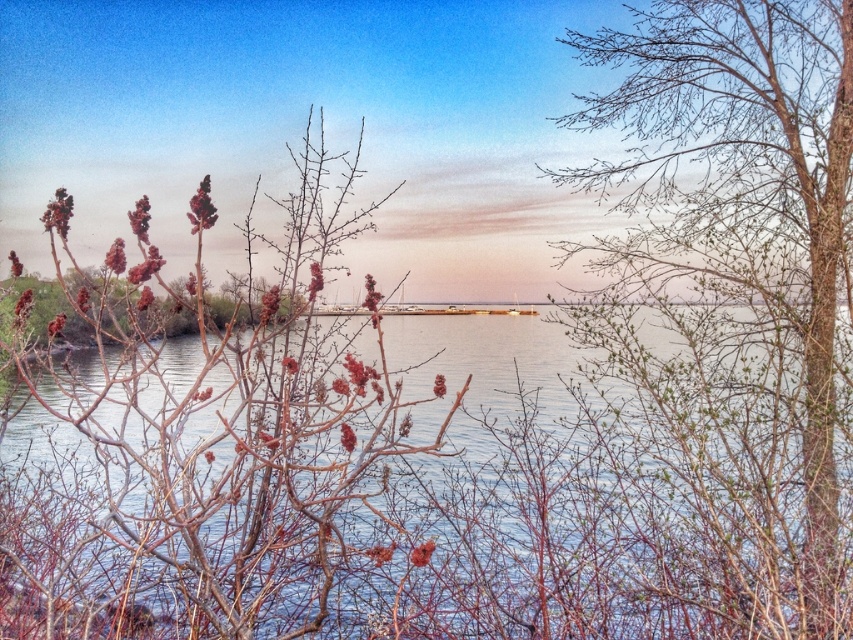
Question: Does clear water at center appear under bare branches at left?

Choices:
 (A) yes
 (B) no

Answer: (A)

Question: Does clear water at center come in front of bare branches at left?

Choices:
 (A) no
 (B) yes

Answer: (A)

Question: Estimate the real-world distances between objects in this image. Which object is closer to the bare branches at left?

Choices:
 (A) bare branches at center
 (B) clear water at center

Answer: (B)

Question: Which point is farther from the camera taking this photo?

Choices:
 (A) (851, 346)
 (B) (306, 513)

Answer: (A)

Question: Which object is farther from the camera taking this photo?

Choices:
 (A) clear water at center
 (B) bare branches at left

Answer: (A)

Question: Is clear water at center above bare branches at center?

Choices:
 (A) yes
 (B) no

Answer: (B)